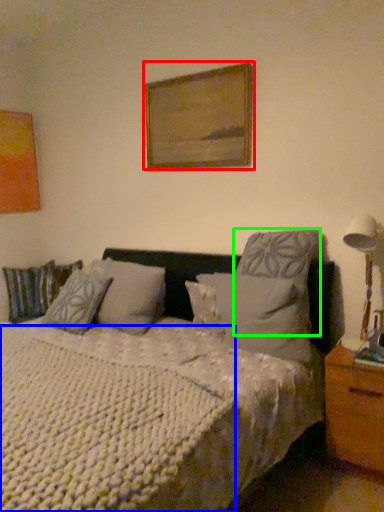
Question: Based on their relative distances, which object is farther from picture frame (highlighted by a red box)? Choose from mattress (highlighted by a blue box) and pillow (highlighted by a green box).

Choices:
 (A) mattress
 (B) pillow

Answer: (A)